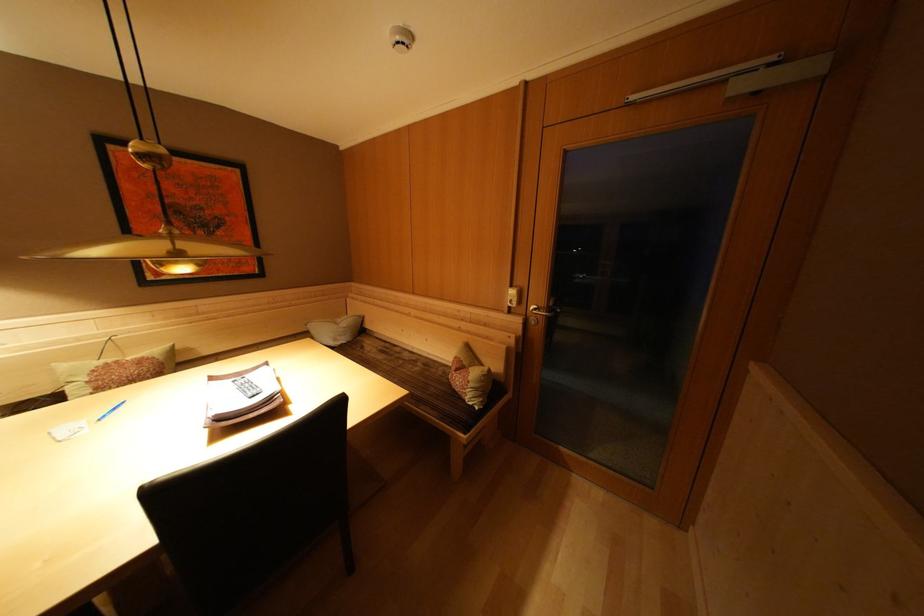
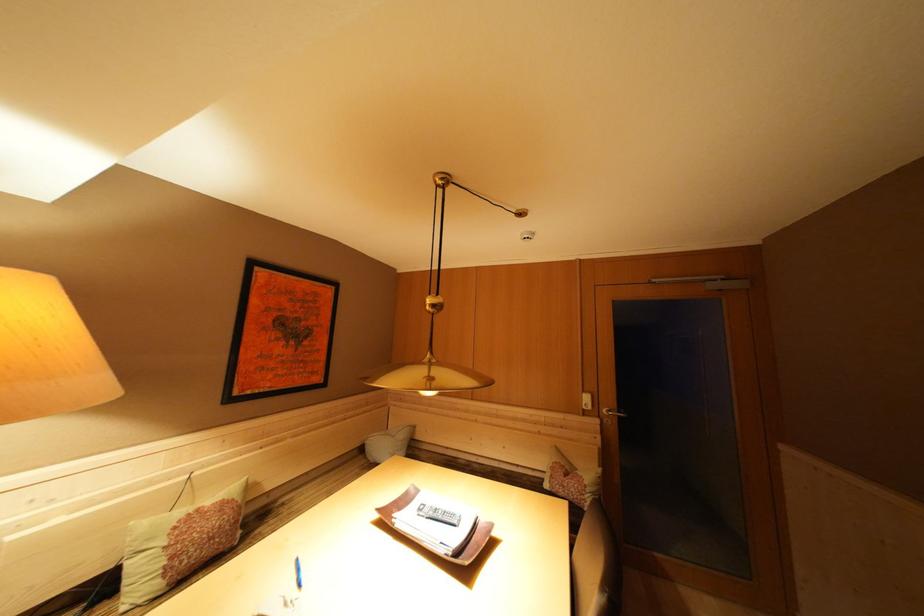
Find the pixel in the second image that matches the point at 179,241 in the first image.

(438, 369)